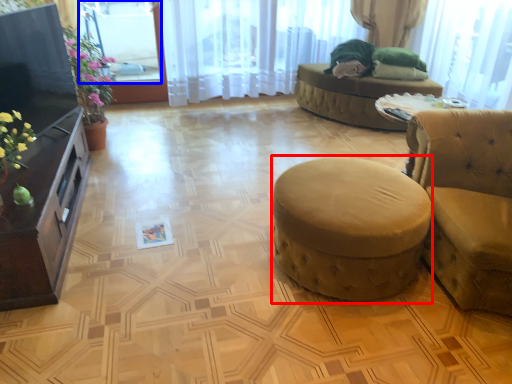
Question: Which object appears closest to the camera in this image, stool (highlighted by a red box) or window screen (highlighted by a blue box)?

Choices:
 (A) stool
 (B) window screen

Answer: (A)